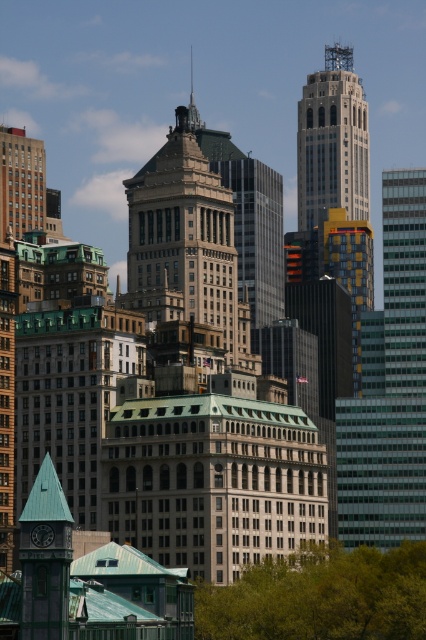
Question: Is matte brown building at center below green matte clock tower at lower left?

Choices:
 (A) no
 (B) yes

Answer: (A)

Question: Among these points, which one is nearest to the camera?

Choices:
 (A) pos(388,621)
 (B) pos(414,435)
 (C) pos(356,77)

Answer: (A)

Question: Estimate the real-world distances between objects in this image. Which object is closer to the green leafy tree at lower center?

Choices:
 (A) light gray concrete skyscraper at upper center
 (B) green matte clock tower at lower left

Answer: (B)

Question: Which of the following is the closest to the observer?

Choices:
 (A) pos(226,244)
 (B) pos(362,172)
 (C) pos(376,592)
 (D) pos(66,515)

Answer: (D)

Question: Is yellow mosaic tile building at right behind light gray concrete skyscraper at upper center?

Choices:
 (A) yes
 (B) no

Answer: (B)

Question: Does green leafy tree at lower center appear on the left side of shiny silver spire at upper center?

Choices:
 (A) yes
 (B) no

Answer: (B)